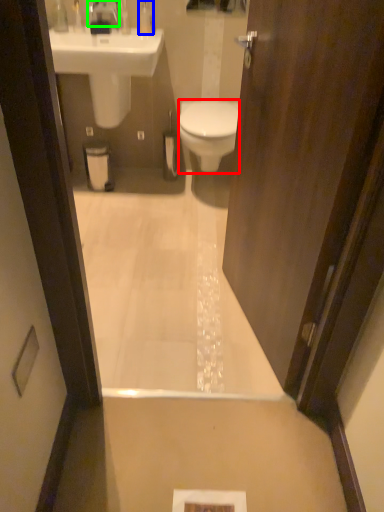
Question: Which is nearer to the bidet (highlighted by a red box)? toiletry (highlighted by a blue box) or faucet (highlighted by a green box).

Choices:
 (A) toiletry
 (B) faucet

Answer: (A)